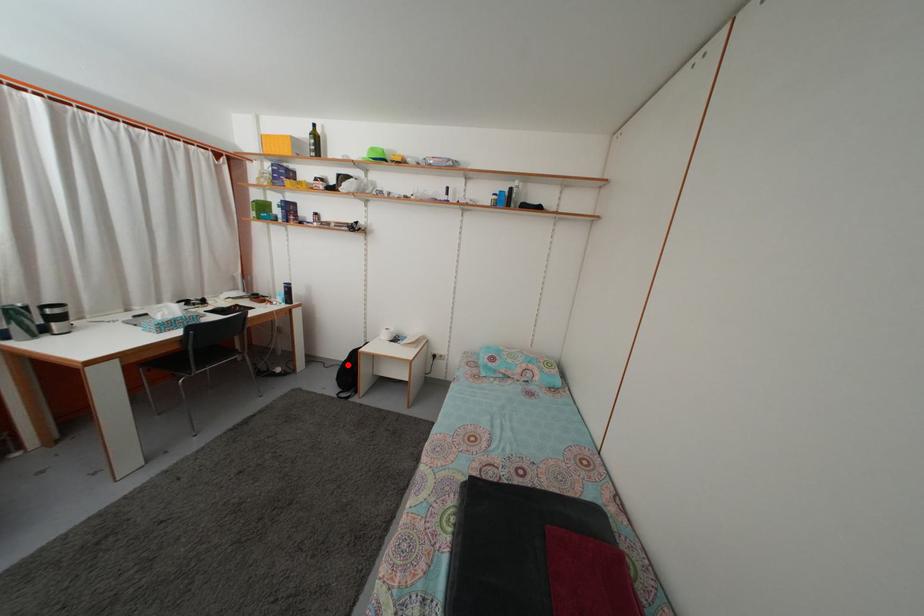
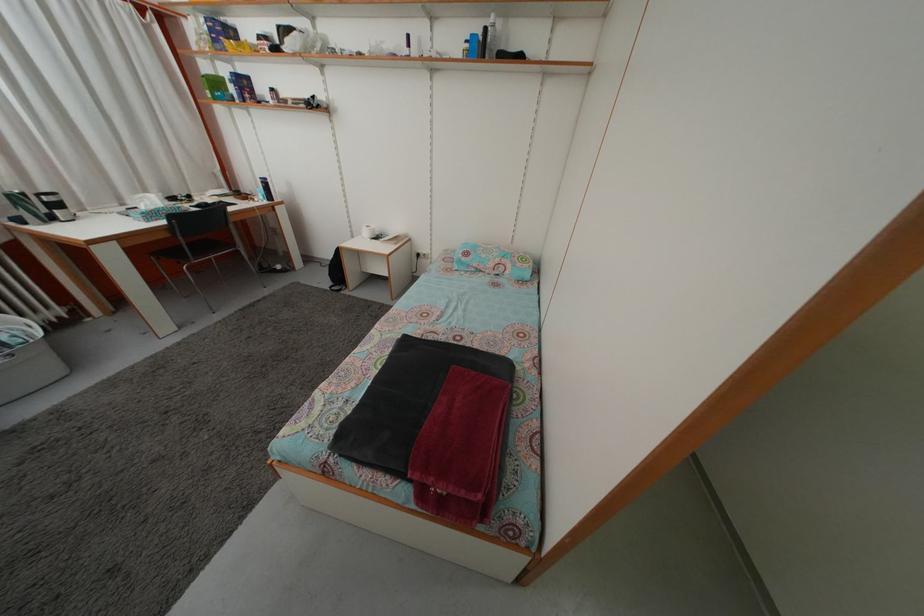
In the second image, find the point that corresponds to the highlighted location in the first image.

(335, 262)